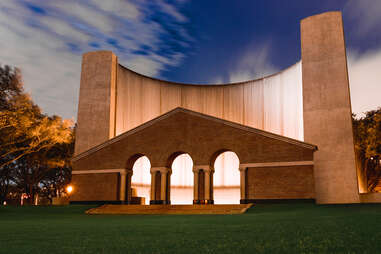
The image size is (381, 254). I want to click on archway, so click(x=138, y=155), click(x=183, y=153), click(x=226, y=154).